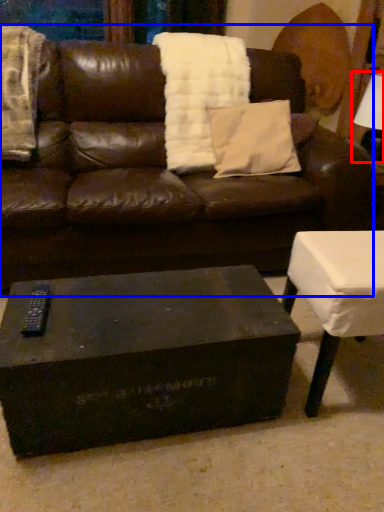
Question: Which object is closer to the camera taking this photo, table lamp (highlighted by a red box) or studio couch (highlighted by a blue box)?

Choices:
 (A) table lamp
 (B) studio couch

Answer: (B)